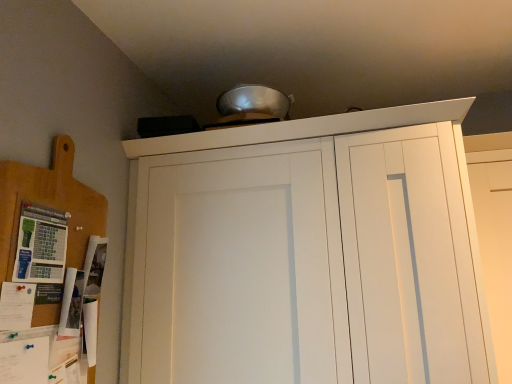
Question: In terms of size, does white matte cupboard at upper center appear bigger or smaller than white matte door at upper center?

Choices:
 (A) small
 (B) big

Answer: (B)

Question: Which is correct: white matte cupboard at upper center is inside white matte door at upper center, or outside of it?

Choices:
 (A) inside
 (B) outside

Answer: (B)

Question: Which is farther from the white matte cupboard at upper center?

Choices:
 (A) wooden cutting board at left
 (B) white matte door at upper center

Answer: (A)

Question: Based on their relative distances, which object is nearer to the white matte door at upper center?

Choices:
 (A) wooden cutting board at left
 (B) white matte cupboard at upper center

Answer: (B)